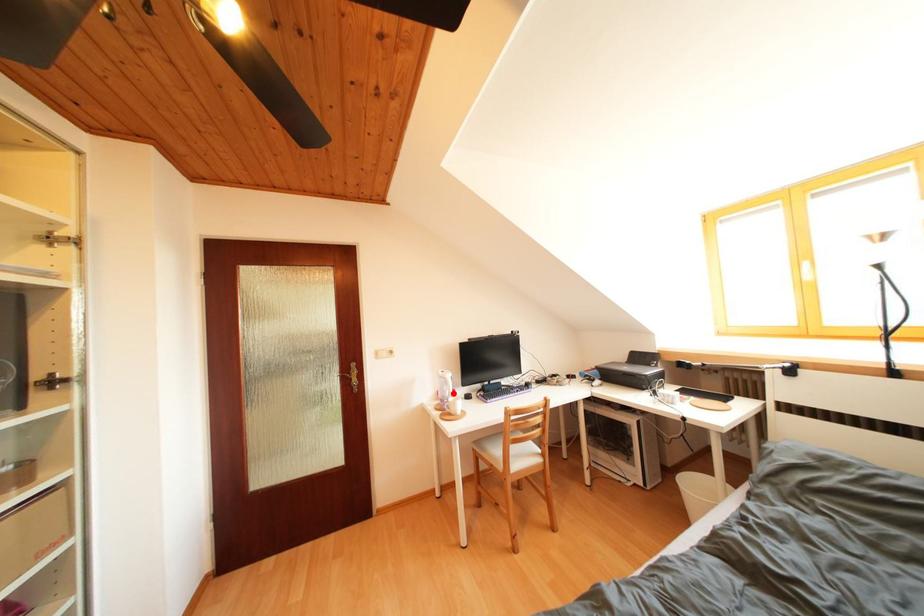
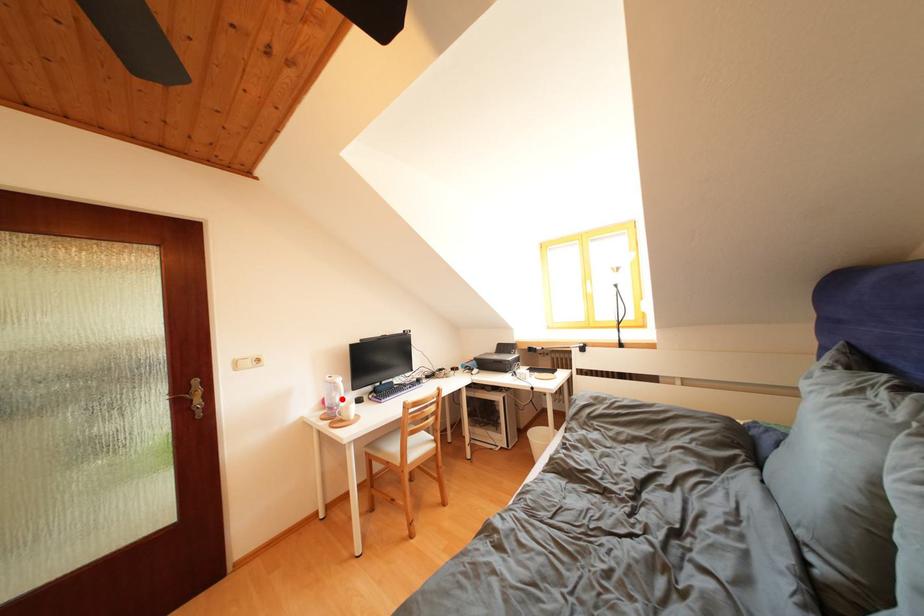
I am providing you with two images of the same scene from different viewpoints. A red point is marked on the first image and another point is marked on the second image. Is the red point in image1 aligned with the point shown in image2?

Yes